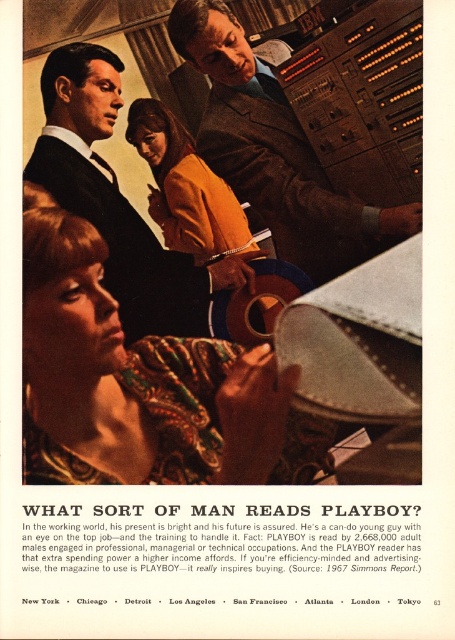
You are an observer in the vintage 1967 Playboy advertisement scene. You notice two individuals at the control panel. One is wearing a matte brown suit at center, and the other has an orange suede jacket at center. Which of these two is positioned closer to you?

The matte brown suit at center is closer to the viewer than the orange suede jacket at center.